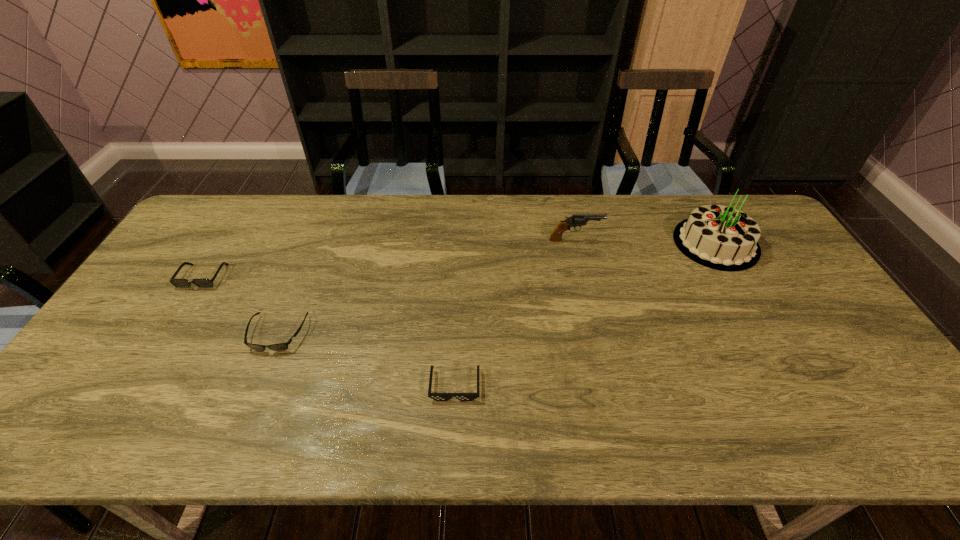
This screenshot has height=540, width=960. Find the location of `free space between the fourth object from right to left and the gun`. free space between the fourth object from right to left and the gun is located at coordinates (426, 287).

Locate an element on the screen. The width and height of the screenshot is (960, 540). free space between the second sunglasses from right to left and the leftmost sunglasses is located at coordinates (240, 305).

Where is `unoccupied position between the fourth object from left to right and the leftmost object`? Image resolution: width=960 pixels, height=540 pixels. unoccupied position between the fourth object from left to right and the leftmost object is located at coordinates (389, 258).

Find the location of a particular element. The image size is (960, 540). object that stands as the fourth closest to the fourth shortest object is located at coordinates (179, 283).

Choose which object is the fourth nearest neighbor to the second object from right to left. Please provide its 2D coordinates. Your answer should be formatted as a tuple, i.e. [(x, y)], where the tuple contains the x and y coordinates of a point satisfying the conditions above.

[(179, 283)]

Locate an element on the screen. sunglasses that is the third nearest to the second object from right to left is located at coordinates (179, 283).

Point out which sunglasses is positioned as the nearest to the leftmost sunglasses. Please provide its 2D coordinates. Your answer should be formatted as a tuple, i.e. [(x, y)], where the tuple contains the x and y coordinates of a point satisfying the conditions above.

[(280, 346)]

Where is `free spot that satisfies the following two spatial constraints: 1. along the barrel of the gun; 2. on the front-facing side of the fourth object from right to left`? The height and width of the screenshot is (540, 960). free spot that satisfies the following two spatial constraints: 1. along the barrel of the gun; 2. on the front-facing side of the fourth object from right to left is located at coordinates (597, 334).

Find the location of `vacant area in the image that satisfies the following two spatial constraints: 1. along the barrel of the second tallest object; 2. on the front-facing side of the second sunglasses from right to left`. vacant area in the image that satisfies the following two spatial constraints: 1. along the barrel of the second tallest object; 2. on the front-facing side of the second sunglasses from right to left is located at coordinates (597, 334).

Find the location of a particular element. The height and width of the screenshot is (540, 960). vacant space that satisfies the following two spatial constraints: 1. along the barrel of the gun; 2. on the front-facing side of the second farthest sunglasses is located at coordinates (597, 334).